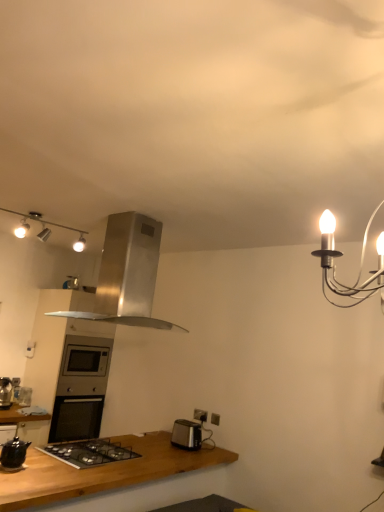
Measure the distance between brown wooden countertop at lower left and camera.

brown wooden countertop at lower left and camera are 1.96 meters apart.

At what (x,y) coordinates should I click in order to perform the action: click on white plastic electric outlet at lower center, the first electric outlet in the back-to-front sequence. Please return your answer as a coordinate pair (x, y). Looking at the image, I should click on (200, 415).

What is the approximate height of satin silver oven at center?

The height of satin silver oven at center is 17.91 inches.

What do you see at coordinates (53, 225) in the screenshot? I see `matte silver track lights at upper left` at bounding box center [53, 225].

Locate an element on the screen. The image size is (384, 512). matte black kettle at lower left is located at coordinates (13, 454).

From a real-world perspective, is satin silver range hood at center physically located above or below white plastic electric outlet at lower center, the second electric outlet positioned from the front?

satin silver range hood at center is above white plastic electric outlet at lower center, the second electric outlet positioned from the front.

Is white plastic electric outlet at lower center, acting as the 1th electric outlet starting from the left, at the back of satin silver range hood at center?

No.

Which of these two, satin silver range hood at center or white plastic electric outlet at lower center, the first electric outlet in the back-to-front sequence, stands shorter?

With less height is white plastic electric outlet at lower center, the first electric outlet in the back-to-front sequence.

Which object is closer to the camera, satin silver range hood at center or white plastic electric outlet at lower center, acting as the 1th electric outlet starting from the left?

satin silver range hood at center is in front.

Is matte gray electric outlet at lower center, which is the 1th electric outlet from front to back, closer to the viewer compared to matte silver track lights at upper left?

No, matte gray electric outlet at lower center, which is the 1th electric outlet from front to back, is further to the viewer.

In terms of size, does matte gray electric outlet at lower center, the 2th electric outlet from the left, appear bigger or smaller than matte silver track lights at upper left?

In the image, matte gray electric outlet at lower center, the 2th electric outlet from the left, appears to be smaller than matte silver track lights at upper left.

Locate an element on the screen. the 1st electric outlet below the matte silver track lights at upper left (from the image's perspective) is located at coordinates (215, 419).

Is matte gray electric outlet at lower center, the 2th electric outlet from the left, taller than matte silver track lights at upper left?

In fact, matte gray electric outlet at lower center, the 2th electric outlet from the left, may be shorter than matte silver track lights at upper left.

Considering the sizes of objects satin silver toaster at lower center and black matte gas stove at lower left in the image provided, who is bigger, satin silver toaster at lower center or black matte gas stove at lower left?

black matte gas stove at lower left.

Considering the positions of points (183, 434) and (128, 449), is point (183, 434) farther from camera compared to point (128, 449)?

Yes, it is behind point (128, 449).

Is satin silver toaster at lower center with black matte gas stove at lower left?

satin silver toaster at lower center and black matte gas stove at lower left are not in contact.

From the image's perspective, is satin silver oven at center positioned above or below black matte gas stove at lower left?

satin silver oven at center is above black matte gas stove at lower left.

Are satin silver oven at center and black matte gas stove at lower left making contact?

No, satin silver oven at center is not touching black matte gas stove at lower left.

Based on their sizes in the image, would you say satin silver oven at center is bigger or smaller than black matte gas stove at lower left?

satin silver oven at center is bigger than black matte gas stove at lower left.

This screenshot has height=512, width=384. What are the coordinates of `oven above the black matte gas stove at lower left (from the image's perspective)` in the screenshot? It's located at (84, 366).

Would you say black matte gas stove at lower left contains matte gray electric outlet at lower center, acting as the 1th electric outlet starting from the right?

No.

Based on the photo, who is taller, black matte gas stove at lower left or matte gray electric outlet at lower center, which is the 1th electric outlet from front to back?

Standing taller between the two is matte gray electric outlet at lower center, which is the 1th electric outlet from front to back.

How different are the orientations of black matte gas stove at lower left and matte gray electric outlet at lower center, which is the 1th electric outlet from front to back, in degrees?

The facing directions of black matte gas stove at lower left and matte gray electric outlet at lower center, which is the 1th electric outlet from front to back, are 89.2 degrees apart.

At what (x,y) coordinates should I click in order to perform the action: click on the 1st electric outlet located above the black matte gas stove at lower left (from a real-world perspective). Please return your answer as a coordinate pair (x, y). The height and width of the screenshot is (512, 384). Looking at the image, I should click on (215, 419).

Is satin silver range hood at center oriented towards matte black kettle at lower left?

No.

How much distance is there between satin silver range hood at center and matte black kettle at lower left?

1.19 meters.

From the image's perspective, does satin silver range hood at center appear lower than matte black kettle at lower left?

No, from the image's perspective, satin silver range hood at center is not beneath matte black kettle at lower left.

Considering the sizes of objects satin silver range hood at center and matte black kettle at lower left in the image provided, who is taller, satin silver range hood at center or matte black kettle at lower left?

With more height is satin silver range hood at center.

Locate an element on the screen. kitchen appliance behind the brown wooden countertop at lower left is located at coordinates click(x=13, y=454).

Are matte black kettle at lower left and brown wooden countertop at lower left located far from each other?

They are positioned close to each other.

Between matte black kettle at lower left and brown wooden countertop at lower left, which one has more height?

Standing taller between the two is brown wooden countertop at lower left.

Is point (7, 443) less distant than point (170, 445)?

Yes, point (7, 443) is closer to viewer.

Starting from the satin silver range hood at center, which electric outlet is the 2nd one behind? Please provide its 2D coordinates.

[(200, 415)]

The width and height of the screenshot is (384, 512). In order to click on lamp above the matte gray electric outlet at lower center, acting as the 1th electric outlet starting from the right (from the image's perspective) in this screenshot , I will do `click(53, 225)`.

When comparing their distances from satin silver oven at center, does brown wooden countertop at lower left or white plastic electric outlet at lower center, which is counted as the second electric outlet, starting from the right, seem further?

Based on the image, brown wooden countertop at lower left appears to be further to satin silver oven at center.

Based on their spatial positions, is brown wooden countertop at lower left or satin silver range hood at center further from brushed metal toaster at lower left?

satin silver range hood at center lies further to brushed metal toaster at lower left than the other object.

Looking at the image, which one is located further to matte black kettle at lower left, satin silver range hood at center or brushed metal toaster at lower left?

brushed metal toaster at lower left is positioned further to the anchor matte black kettle at lower left.

Based on their spatial positions, is matte black kettle at lower left or satin silver range hood at center closer to matte gray electric outlet at lower center, which is the 1th electric outlet from front to back?

satin silver range hood at center lies closer to matte gray electric outlet at lower center, which is the 1th electric outlet from front to back, than the other object.

Which object lies nearer to the anchor point satin silver oven at center, brown wooden countertop at lower left or black matte gas stove at lower left?

black matte gas stove at lower left is positioned closer to the anchor satin silver oven at center.

Estimate the real-world distances between objects in this image. Which object is closer to matte gray electric outlet at lower center, which is the 1th electric outlet from front to back, satin silver range hood at center or black matte gas stove at lower left?

Based on the image, black matte gas stove at lower left appears to be nearer to matte gray electric outlet at lower center, which is the 1th electric outlet from front to back.

When comparing their distances from matte black kettle at lower left, does matte silver track lights at upper left or brushed metal toaster at lower left seem closer?

brushed metal toaster at lower left.

Which object lies nearer to the anchor point matte black kettle at lower left, satin silver range hood at center or white plastic electric outlet at lower center, the second electric outlet positioned from the front?

satin silver range hood at center is closer to matte black kettle at lower left.

Where is `home appliance between matte black kettle at lower left and brushed metal toaster at lower left from front to back`? The height and width of the screenshot is (512, 384). home appliance between matte black kettle at lower left and brushed metal toaster at lower left from front to back is located at coordinates (127, 274).

This screenshot has width=384, height=512. I want to click on gas stove located between matte black kettle at lower left and satin silver toaster at lower center in the left-right direction, so click(89, 453).

Find the location of `kitchen appliance between matte silver track lights at upper left and matte gray electric outlet at lower center, the second electric outlet positioned from the back, vertically`. kitchen appliance between matte silver track lights at upper left and matte gray electric outlet at lower center, the second electric outlet positioned from the back, vertically is located at coordinates (13, 454).

Where is `oven between matte silver track lights at upper left and satin silver toaster at lower center in the vertical direction`? The width and height of the screenshot is (384, 512). oven between matte silver track lights at upper left and satin silver toaster at lower center in the vertical direction is located at coordinates (84, 366).